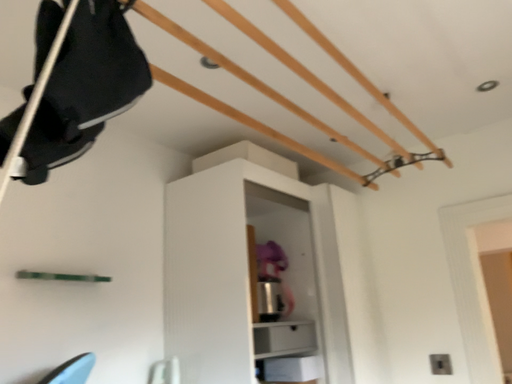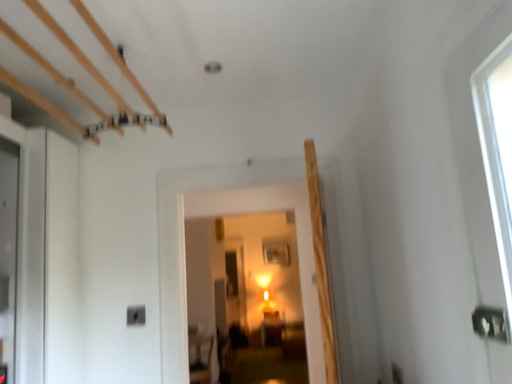
Question: How did the camera likely rotate when shooting the video?

Choices:
 (A) rotated right
 (B) rotated left

Answer: (A)